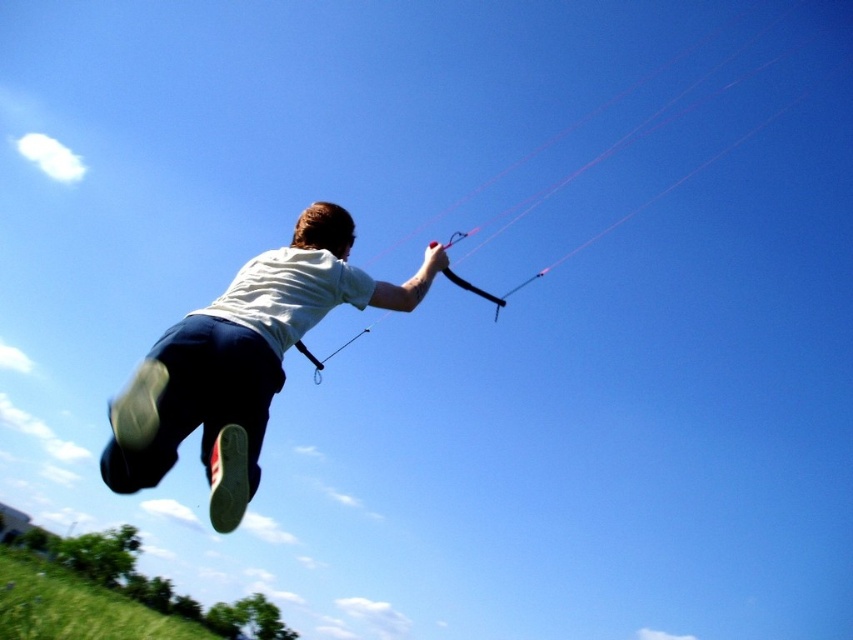
Which of these two, white cotton shirt at center or green grassy hillside at lower left, stands taller?

Standing taller between the two is green grassy hillside at lower left.

Does white cotton shirt at center appear on the right side of green grassy hillside at lower left?

Indeed, white cotton shirt at center is positioned on the right side of green grassy hillside at lower left.

This screenshot has height=640, width=853. I want to click on white cotton shirt at center, so point(241,362).

Is white cotton shirt at center below black matte parachute at upper center?

Indeed, white cotton shirt at center is positioned under black matte parachute at upper center.

Does white cotton shirt at center have a greater width compared to black matte parachute at upper center?

No.

Is point (274, 304) farther from viewer compared to point (605, 102)?

No, it is in front of (605, 102).

Where is `white cotton shirt at center`? white cotton shirt at center is located at coordinates (241, 362).

Who is shorter, green grassy hillside at lower left or black matte parachute at upper center?

black matte parachute at upper center

Which is behind, point (10, 593) or point (664, 108)?

Positioned behind is point (664, 108).

You are a GUI agent. You are given a task and a screenshot of the screen. Output one action in this format:
    pyautogui.click(x=<x>, y=<y>)
    Task: Click on the green grassy hillside at lower left
    The image size is (853, 640).
    Given the screenshot: What is the action you would take?
    pyautogui.click(x=74, y=608)